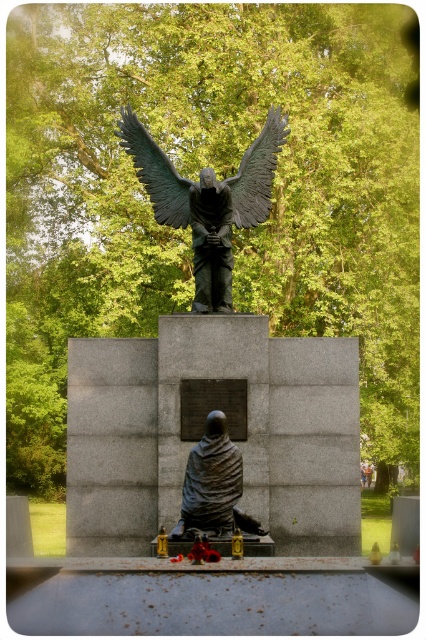
In the serene outdoor memorial scene, there are two bronze statues. The first is a bronze textured eagle at upper center, and the second is a matte bronze statue at center. From the perspective of someone standing in front of the memorial, which statue is positioned to the left of the other?

The bronze textured eagle at upper center is positioned to the left of the matte bronze statue at center.

You are a tour guide explaining the memorial sculpture to visitors. You want to mention the distance between the bronze statue at center and the bronze textured eagle at upper center. What should you say?

The bronze statue at center and the bronze textured eagle at upper center are 9.66 feet apart from each other.